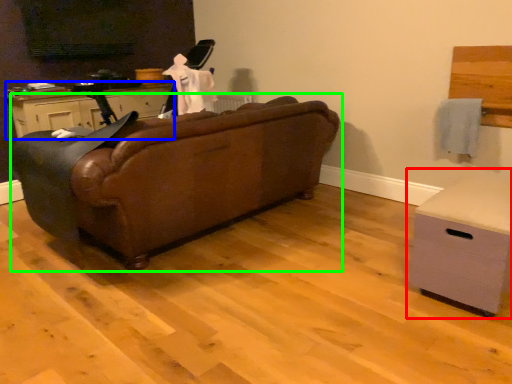
Question: Estimate the real-world distances between objects in this image. Which object is farther from chest of drawers (highlighted by a red box), cabinetry (highlighted by a blue box) or studio couch (highlighted by a green box)?

Choices:
 (A) cabinetry
 (B) studio couch

Answer: (A)